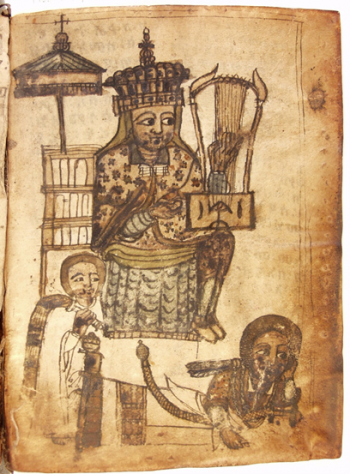
At what (x,y) coordinates should I click in order to perform the action: click on hookah pipe. Please return your answer as a coordinate pair (x, y). Looking at the image, I should click on (40, 318).